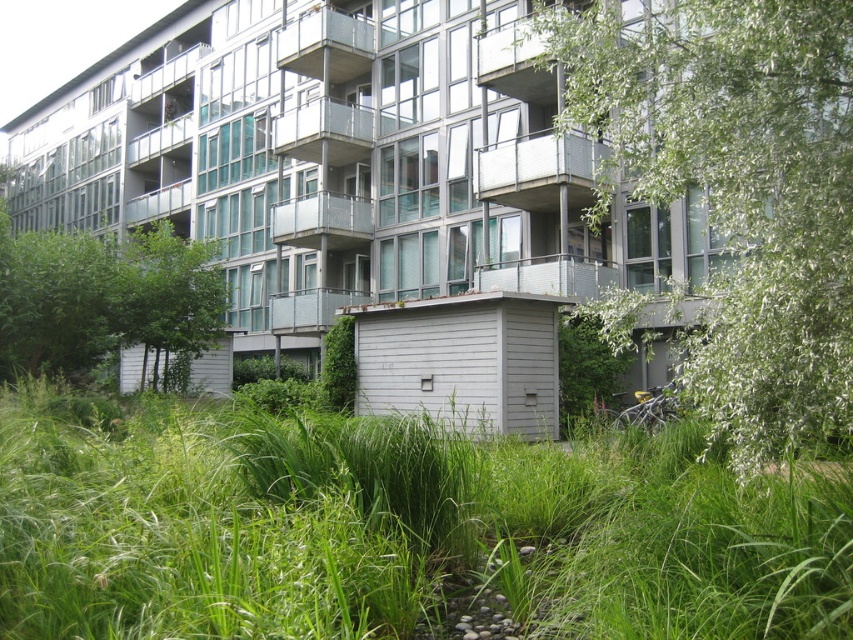
Is green leafy tree at right wider than green leafy tree at left?

Yes, green leafy tree at right is wider than green leafy tree at left.

Does green leafy tree at right have a smaller size compared to green leafy tree at left?

Incorrect, green leafy tree at right is not smaller in size than green leafy tree at left.

What are the coordinates of `green leafy tree at right` in the screenshot? It's located at [735, 188].

Is point (74, 531) in front of point (709, 394)?

That is True.

Find the location of a particular element. The height and width of the screenshot is (640, 853). green grass at center is located at coordinates (392, 531).

Where is `green grass at center`? This screenshot has height=640, width=853. green grass at center is located at coordinates (392, 531).

Does green leafy tree at left have a larger size compared to green leafy tree at center?

Actually, green leafy tree at left might be smaller than green leafy tree at center.

Can you confirm if green leafy tree at left is positioned to the left of green leafy tree at center?

In fact, green leafy tree at left is to the right of green leafy tree at center.

Does point (103, 268) come farther from viewer compared to point (142, 234)?

That is False.

In order to click on green leafy tree at left in this screenshot , I will do `click(53, 300)`.